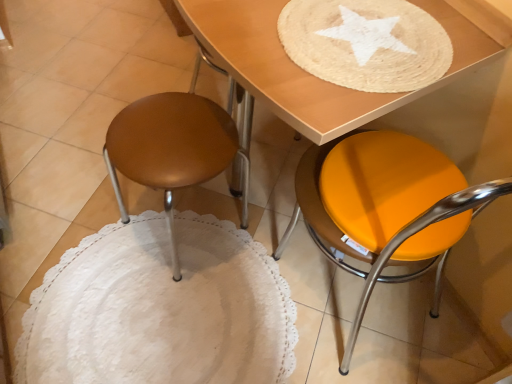
Where is `vacant space to the left of orange matte stool at lower right`? This screenshot has width=512, height=384. vacant space to the left of orange matte stool at lower right is located at coordinates (231, 329).